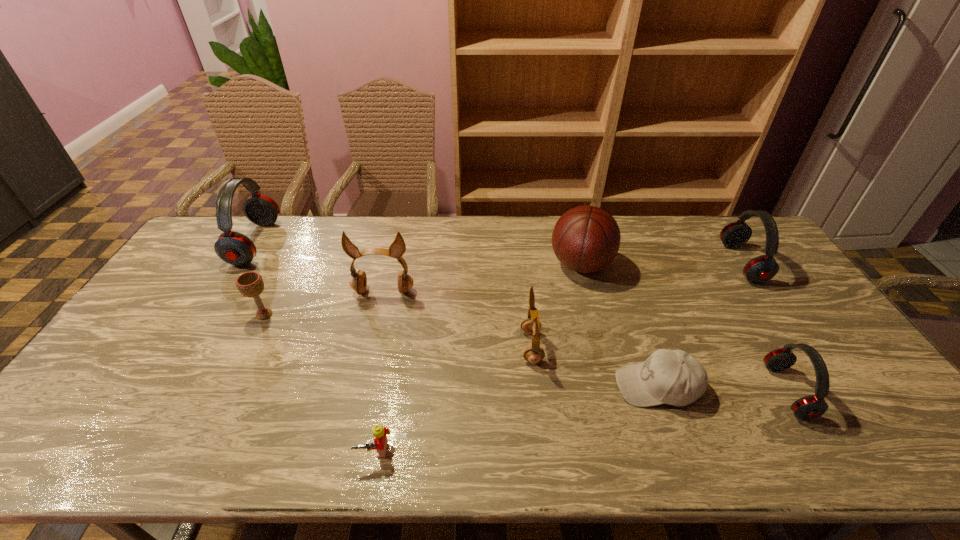
Identify the location of vacant area situated on the front-facing side of the gray baseball cap. (462, 386).

Image resolution: width=960 pixels, height=540 pixels. I want to click on basketball at the far edge, so click(585, 239).

This screenshot has height=540, width=960. In order to click on object positioned at the near edge in this screenshot , I will do `click(379, 432)`.

Where is `object that is at the left edge`? The height and width of the screenshot is (540, 960). object that is at the left edge is located at coordinates (234, 248).

This screenshot has height=540, width=960. Identify the location of object at the right edge. (760, 269).

The height and width of the screenshot is (540, 960). I want to click on object that is at the far left corner, so coord(234,248).

Identify the location of object that is positioned at the far right corner. The width and height of the screenshot is (960, 540). (760, 269).

Find the location of `vacant space at the far edge`. vacant space at the far edge is located at coordinates (676, 253).

This screenshot has height=540, width=960. In order to click on vacant area at the near edge of the desktop in this screenshot , I will do `click(542, 444)`.

The height and width of the screenshot is (540, 960). In the image, there is a desktop. Find the location of `vacant space at the right edge`. vacant space at the right edge is located at coordinates (791, 281).